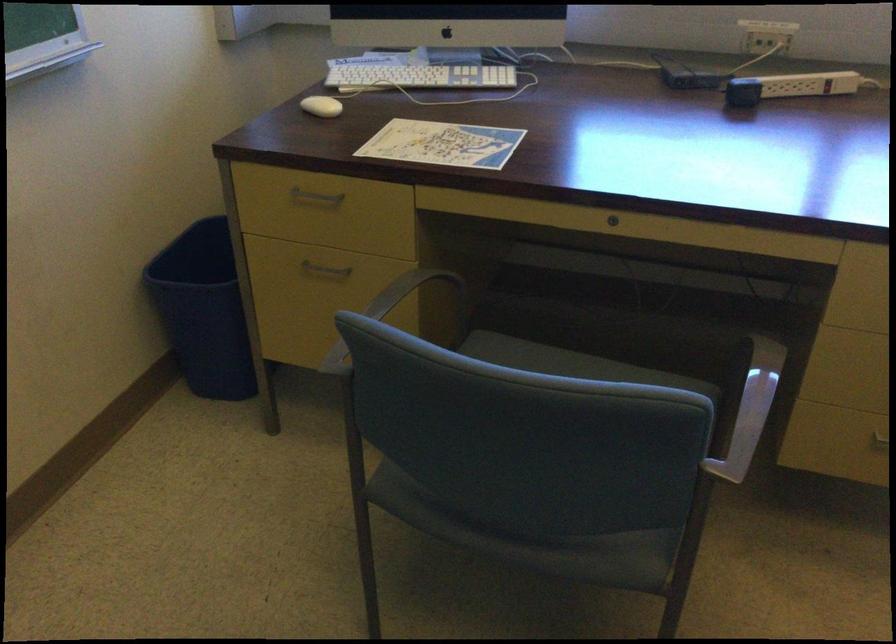
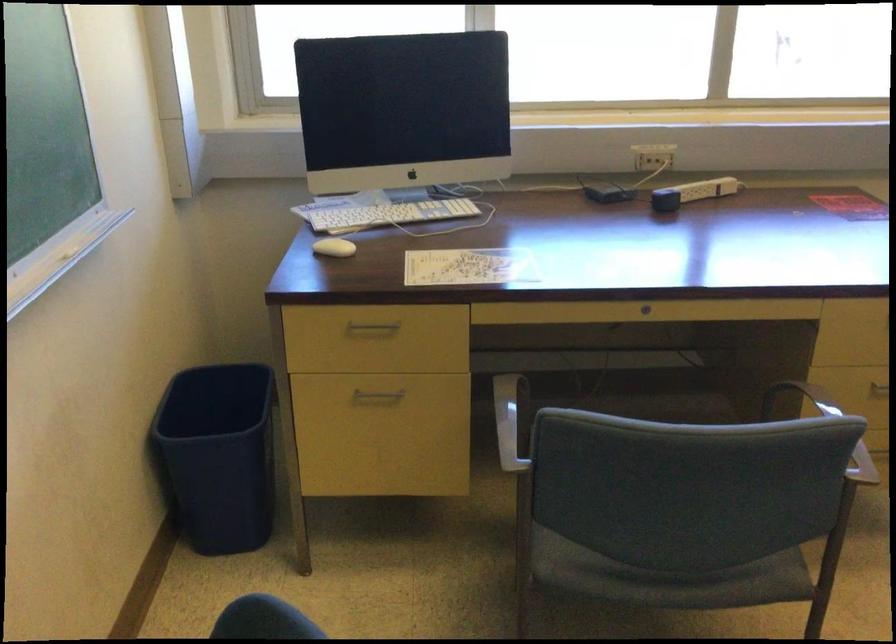
Locate, in the second image, the point that corresponds to (197,306) in the first image.

(217, 456)